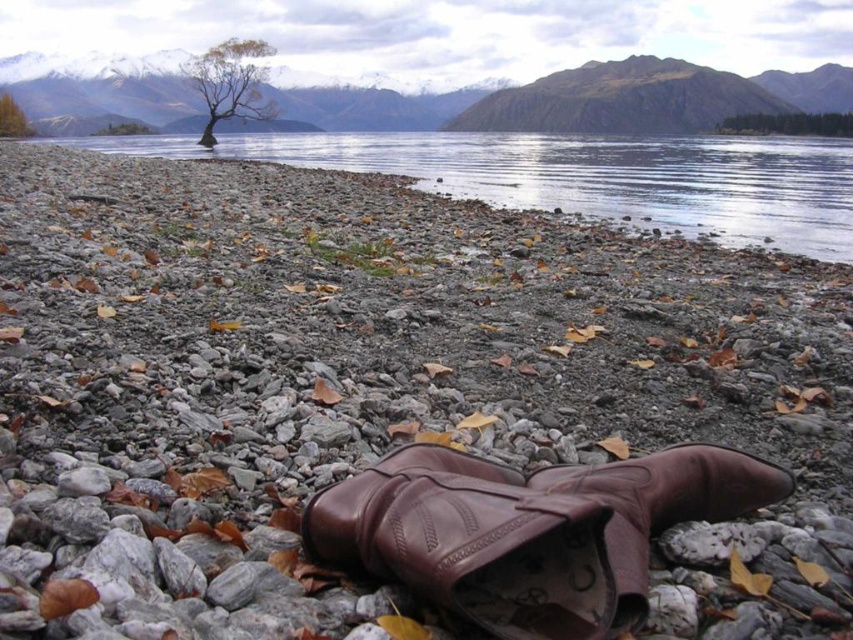
Is brown leather boot at center taller than clear water at shore center?

No.

Does point (332, 547) come closer to viewer compared to point (850, 138)?

Yes, it is in front of point (850, 138).

Locate an element on the screen. The image size is (853, 640). brown leather boot at center is located at coordinates (527, 531).

Is clear water at shore center taller than green leafy tree at upper right?

Yes, clear water at shore center is taller than green leafy tree at upper right.

Can you confirm if clear water at shore center is positioned above green leafy tree at upper right?

Incorrect, clear water at shore center is not positioned above green leafy tree at upper right.

Who is more distant from viewer, (733, 218) or (752, 125)?

The point (752, 125) is behind.

The height and width of the screenshot is (640, 853). Identify the location of clear water at shore center. (585, 176).

Is clear water at shore center wider than green leafy tree at center?

Correct, the width of clear water at shore center exceeds that of green leafy tree at center.

Does point (492, 177) come behind point (119, 122)?

No, (492, 177) is closer to viewer.

I want to click on clear water at shore center, so click(x=585, y=176).